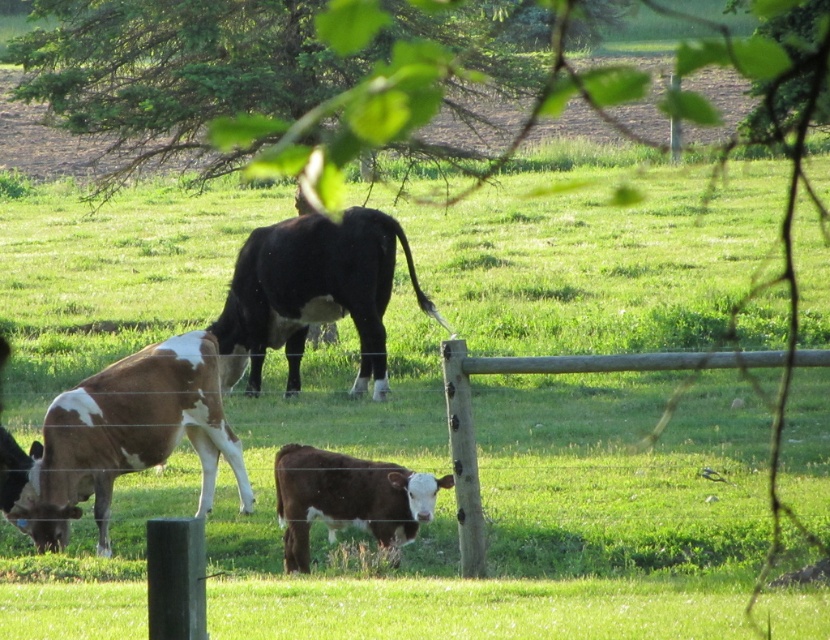
Question: Is black glossy cow at center to the right of brown smooth calf at center from the viewer's perspective?

Choices:
 (A) no
 (B) yes

Answer: (A)

Question: Estimate the real-world distances between objects in this image. Which object is closer to the black glossy cow at center?

Choices:
 (A) brown smooth calf at center
 (B) green leafy tree at upper center

Answer: (A)

Question: Can you confirm if green leafy tree at upper center is positioned below brown and white speckled cow at left?

Choices:
 (A) no
 (B) yes

Answer: (A)

Question: Is green leafy tree at upper center further to the viewer compared to brown smooth calf at center?

Choices:
 (A) yes
 (B) no

Answer: (A)

Question: Which of the following is the farthest from the observer?

Choices:
 (A) (247, 387)
 (B) (174, 380)
 (C) (364, 499)
 (D) (818, 77)

Answer: (D)

Question: Which of these objects is positioned closest to the brown and white speckled cow at left?

Choices:
 (A) brown smooth calf at center
 (B) black glossy cow at center

Answer: (A)